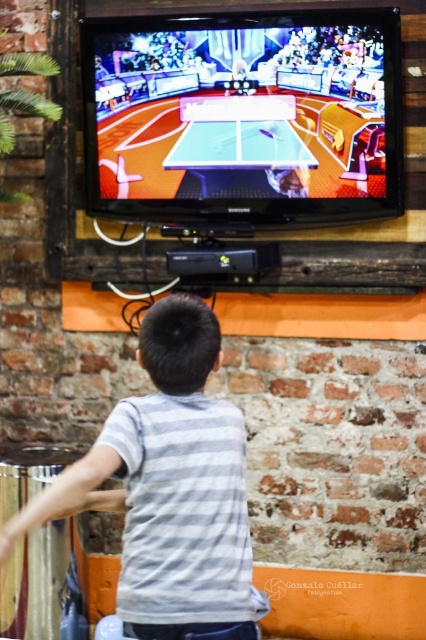
Between shiny plastic table at upper center and gray striped shirt at center, which one has more height?

Standing taller between the two is gray striped shirt at center.

Who is shorter, shiny plastic table at upper center or gray striped shirt at center?

Standing shorter between the two is shiny plastic table at upper center.

Find the location of a particular element. The width and height of the screenshot is (426, 640). shiny plastic table at upper center is located at coordinates (244, 116).

I want to click on shiny plastic table at upper center, so 244,116.